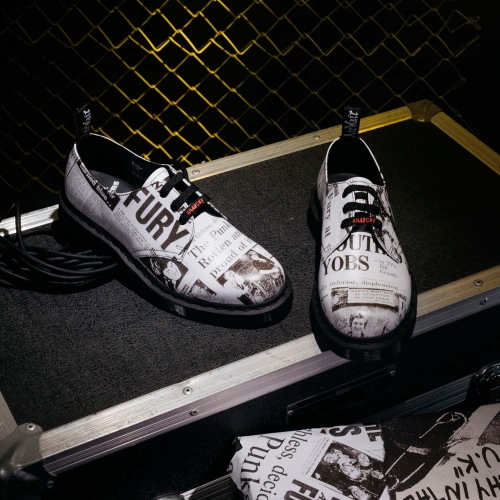
The height and width of the screenshot is (500, 500). In order to click on cord in this screenshot , I will do `click(63, 280)`.